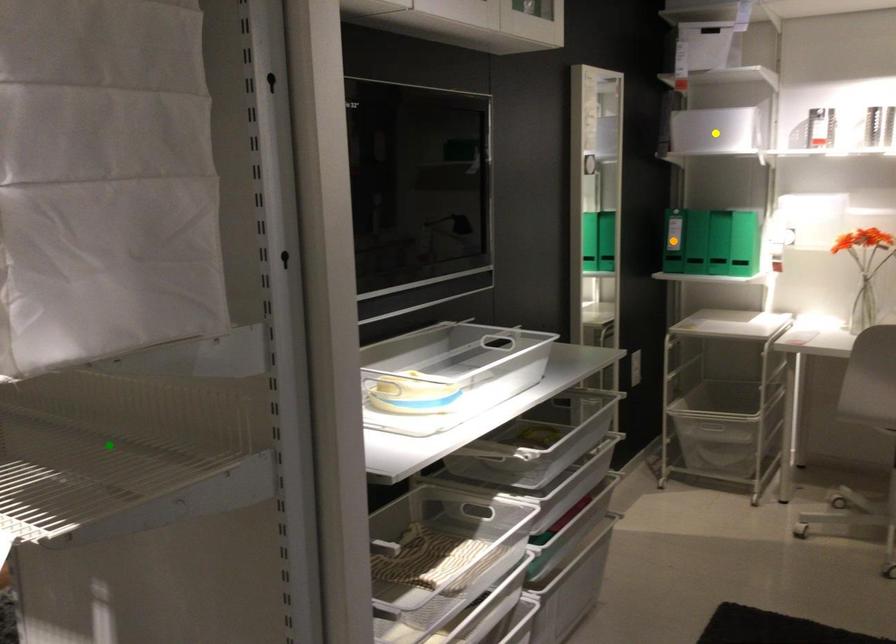
Order these from nearest to farthest:
green point, orange point, yellow point

green point → yellow point → orange point